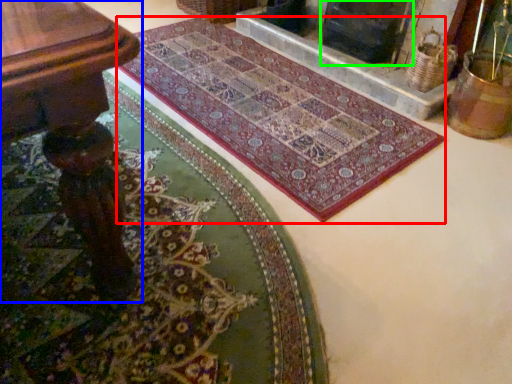
Question: Based on their relative distances, which object is farther from mat (highlighted by a red box)? Choose from table (highlighted by a blue box) and fireplace (highlighted by a green box).

Choices:
 (A) table
 (B) fireplace

Answer: (A)